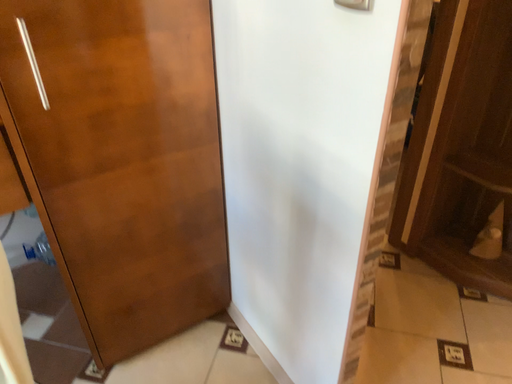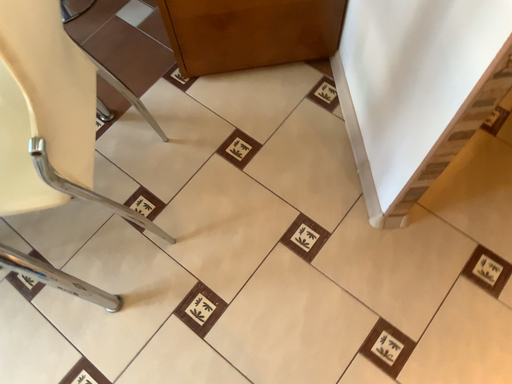
Question: How did the camera likely rotate when shooting the video?

Choices:
 (A) rotated left
 (B) rotated right

Answer: (A)